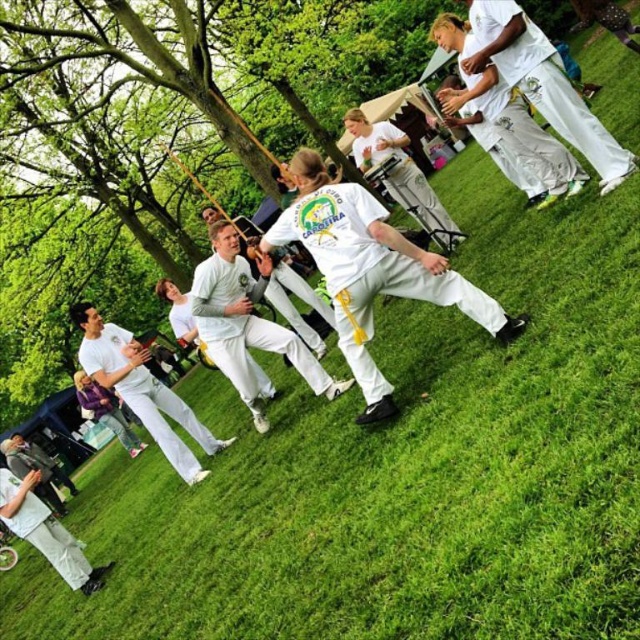
Question: Estimate the real-world distances between objects in this image. Which object is farther from the white matte pants at lower left?

Choices:
 (A) white cotton pants at lower left
 (B) white cotton t-shirt at center
 (C) white matte pants at center
 (D) white matte uniform at center

Answer: (B)

Question: Is the position of white matte pants at lower left less distant than that of white cotton pants at lower left?

Choices:
 (A) no
 (B) yes

Answer: (A)

Question: From the image, what is the correct spatial relationship of white cotton pants at center in relation to white cotton t-shirt at center?

Choices:
 (A) above
 (B) below

Answer: (A)

Question: Estimate the real-world distances between objects in this image. Which object is closer to the white matte uniform at center?

Choices:
 (A) white matte pants at lower left
 (B) white cotton pants at lower left

Answer: (A)

Question: Which of the following is the closest to the observer?

Choices:
 (A) (6, 500)
 (B) (108, 326)

Answer: (A)

Question: Is white matte uniform at center thinner than white cotton pants at center?

Choices:
 (A) yes
 (B) no

Answer: (B)